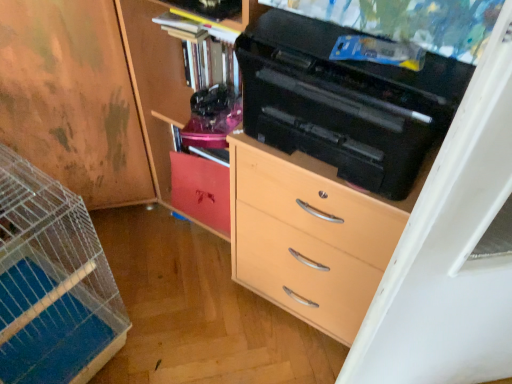
What are the coordinates of `vacant space situated on the left part of matte wood cabinet at center, placed as the 2th cabinetry when sorted from left to right` in the screenshot? It's located at (158, 230).